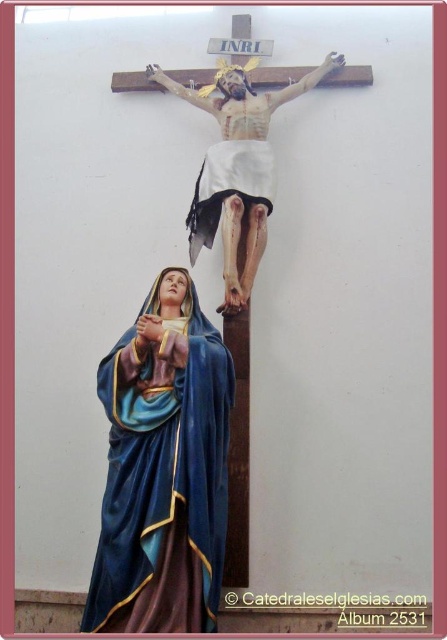
Question: Does matte blue fabric statue at lower left appear under wooden crucifix at upper center?

Choices:
 (A) no
 (B) yes

Answer: (B)

Question: Which point is farther to the camera?

Choices:
 (A) (192, 436)
 (B) (237, 198)

Answer: (B)

Question: Does matte blue fabric statue at lower left have a smaller size compared to wooden crucifix at upper center?

Choices:
 (A) yes
 (B) no

Answer: (A)

Question: Can you confirm if matte blue fabric statue at lower left is thinner than wooden crucifix at upper center?

Choices:
 (A) yes
 (B) no

Answer: (A)

Question: Which point is farther from the camera taking this photo?

Choices:
 (A) (171, 81)
 (B) (189, 316)

Answer: (A)